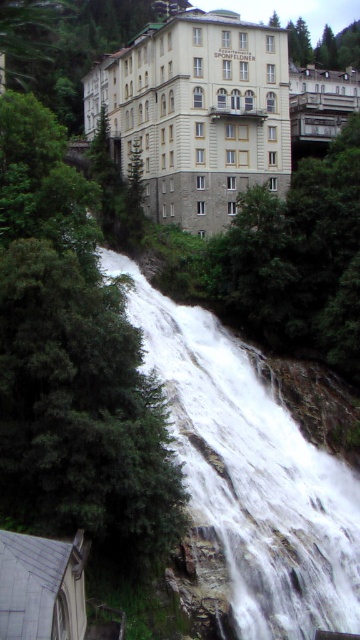
Based on the photo, you are standing at the center of the image and want to take a photo of the Appartements Sponfeldoner building. To avoid the green leafy tree at left from blocking the view, in which direction should you move?

Since the green leafy tree at left is located at point 0.567 on the x axis and 0.203 on the y axis, you should move to the right to avoid it blocking the view of the Appartements Sponfeldoner building.

You are a photographer planning to capture the Appartements Sponfeldoner from a specific angle. You want to ensure that both the gray slate roof at lower left and the matte white balcony at upper center are clearly visible in your shot. Considering their sizes, which object should you prioritize positioning closer to the camera to maintain detail?

The gray slate roof at lower left is smaller than the matte white balcony at upper center. To maintain detail, prioritize positioning the smaller gray slate roof at lower left closer to the camera since it requires more focus to capture its features clearly.